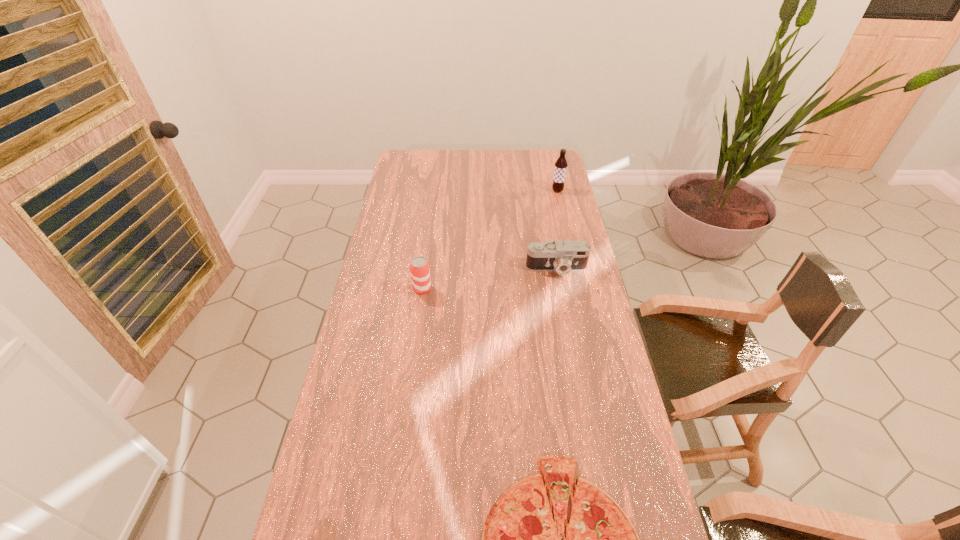
You are a GUI agent. You are given a task and a screenshot of the screen. Output one action in this format:
    pyautogui.click(x=<x>, y=<y>)
    Task: Click on the camera that is at the right edge
    Image resolution: width=960 pixels, height=540 pixels.
    Given the screenshot: What is the action you would take?
    pyautogui.click(x=570, y=255)

Identify the location of vacant space at the far edge of the desktop. This screenshot has width=960, height=540. (468, 170).

Identify the location of blank area at the left edge. This screenshot has height=540, width=960. (411, 190).

In the image, there is a desktop. Where is `vacant space at the right edge`? This screenshot has height=540, width=960. vacant space at the right edge is located at coordinates (546, 223).

Image resolution: width=960 pixels, height=540 pixels. In the image, there is a desktop. Find the location of `free region at the far left corner`. free region at the far left corner is located at coordinates (397, 170).

The height and width of the screenshot is (540, 960). I want to click on free space between the beer can and the tallest object, so click(490, 240).

Find the location of a particular element. The image size is (960, 540). free point between the camera and the second nearest object is located at coordinates (490, 279).

Image resolution: width=960 pixels, height=540 pixels. I want to click on free space between the third shortest object and the camera, so click(x=490, y=279).

Locate which object ranks in proximity to the third tallest object. Please provide its 2D coordinates. Your answer should be formatted as a tuple, i.e. [(x, y)], where the tuple contains the x and y coordinates of a point satisfying the conditions above.

[(419, 267)]

Point out which object is positioned as the third nearest to the shortest object. Please provide its 2D coordinates. Your answer should be formatted as a tuple, i.e. [(x, y)], where the tuple contains the x and y coordinates of a point satisfying the conditions above.

[(560, 169)]